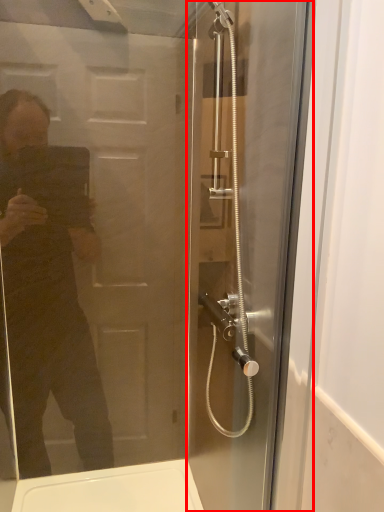
Question: From the image's perspective, where is screen door (annotated by the red box) located relative to screen door?

Choices:
 (A) below
 (B) above

Answer: (B)